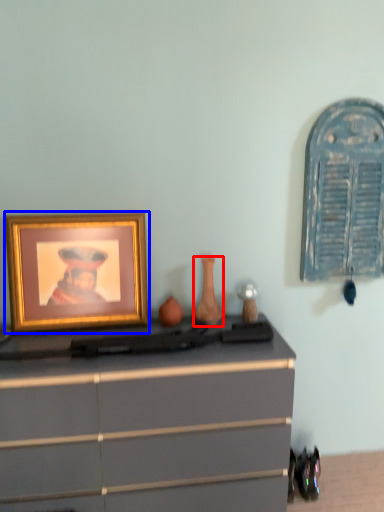
Question: Which object appears farthest to the camera in this image, vase (highlighted by a red box) or picture frame (highlighted by a blue box)?

Choices:
 (A) vase
 (B) picture frame

Answer: (A)